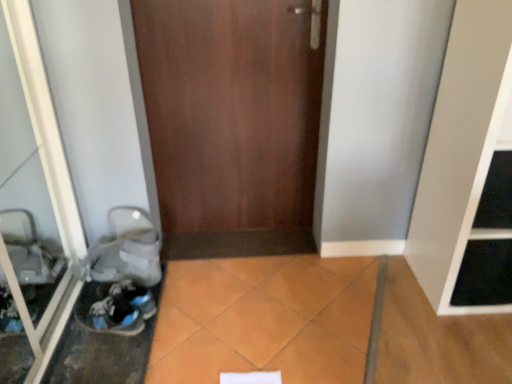
Question: Does transparent glass door at left have a greater width compared to white matte shelf at right?

Choices:
 (A) yes
 (B) no

Answer: (B)

Question: Is white matte shelf at right a part of transparent glass door at left?

Choices:
 (A) no
 (B) yes

Answer: (A)

Question: Can you confirm if transparent glass door at left is taller than white matte shelf at right?

Choices:
 (A) yes
 (B) no

Answer: (B)

Question: Considering the relative positions of transparent glass door at left and white matte shelf at right in the image provided, is transparent glass door at left to the right of white matte shelf at right from the viewer's perspective?

Choices:
 (A) yes
 (B) no

Answer: (B)

Question: Is transparent glass door at left bigger than white matte shelf at right?

Choices:
 (A) yes
 (B) no

Answer: (B)

Question: Could you tell me if transparent glass door at left is turned towards white matte shelf at right?

Choices:
 (A) no
 (B) yes

Answer: (B)

Question: Would you say blue suede sneakers at lower left contains transparent glass door at left?

Choices:
 (A) no
 (B) yes

Answer: (A)

Question: Is blue suede sneakers at lower left looking in the opposite direction of transparent glass door at left?

Choices:
 (A) yes
 (B) no

Answer: (A)

Question: Is blue suede sneakers at lower left closer to camera compared to transparent glass door at left?

Choices:
 (A) no
 (B) yes

Answer: (A)

Question: Is blue suede sneakers at lower left further to the viewer compared to transparent glass door at left?

Choices:
 (A) yes
 (B) no

Answer: (A)

Question: Is blue suede sneakers at lower left beside transparent glass door at left?

Choices:
 (A) no
 (B) yes

Answer: (A)

Question: From a real-world perspective, is blue suede sneakers at lower left over transparent glass door at left?

Choices:
 (A) yes
 (B) no

Answer: (B)

Question: From the image's perspective, is white matte shelf at right beneath transparent glass door at left?

Choices:
 (A) yes
 (B) no

Answer: (B)